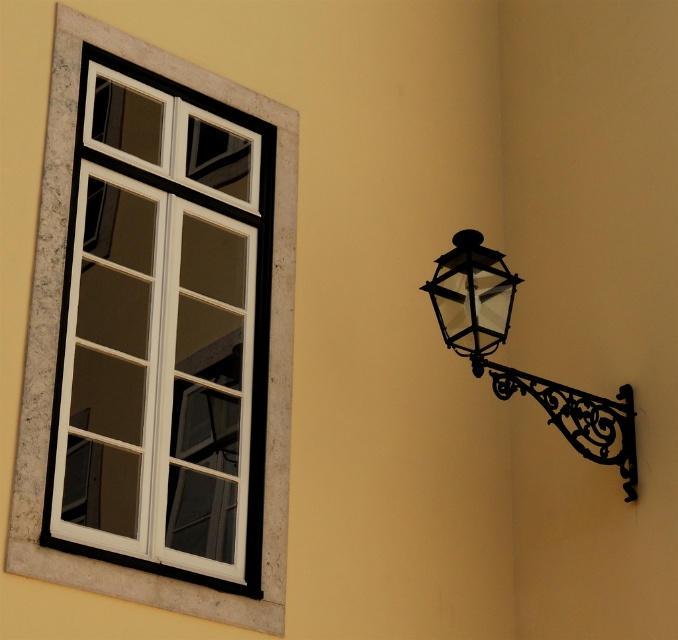
You are a GUI agent. You are given a task and a screenshot of the screen. Output one action in this format:
    pyautogui.click(x=<x>, y=<y>)
    Task: Click on the white matte window at left
    This screenshot has height=640, width=678.
    Given the screenshot: What is the action you would take?
    pyautogui.click(x=163, y=332)

Does white matte window at left have a greater height compared to black wrought iron streetlamp at right?

Incorrect, white matte window at left's height is not larger of black wrought iron streetlamp at right's.

Identify the location of white matte window at left. (163, 332).

Which is behind, point (178, 225) or point (492, 282)?

Point (178, 225)

Which is more to the left, white matte window at left or black wrought iron lantern at right?

Positioned to the left is white matte window at left.

Which is behind, point (262, 257) or point (473, 248)?

Positioned behind is point (262, 257).

You are a GUI agent. You are given a task and a screenshot of the screen. Output one action in this format:
    pyautogui.click(x=<x>, y=<y>)
    Task: Click on the white matte window at left
    
    Given the screenshot: What is the action you would take?
    pyautogui.click(x=163, y=332)

Between black wrought iron streetlamp at right and black wrought iron lantern at right, which one is positioned lower?

black wrought iron streetlamp at right

Based on the photo, is black wrought iron streetlamp at right positioned before black wrought iron lantern at right?

No, it is behind black wrought iron lantern at right.

Image resolution: width=678 pixels, height=640 pixels. Find the location of `black wrought iron streetlamp at right`. black wrought iron streetlamp at right is located at coordinates (515, 369).